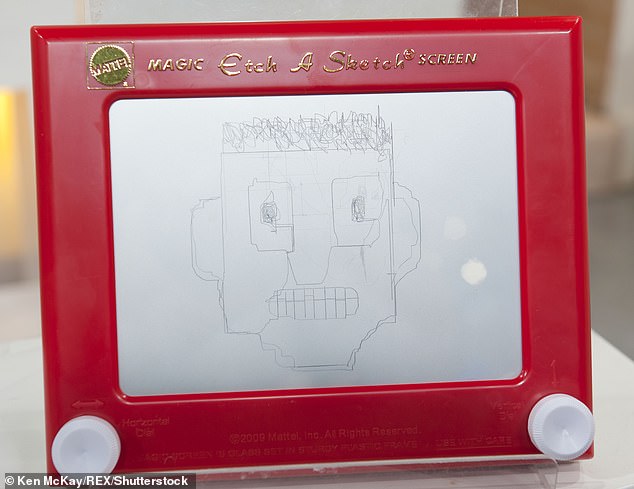
The width and height of the screenshot is (634, 489). I want to click on screen, so click(150, 201).